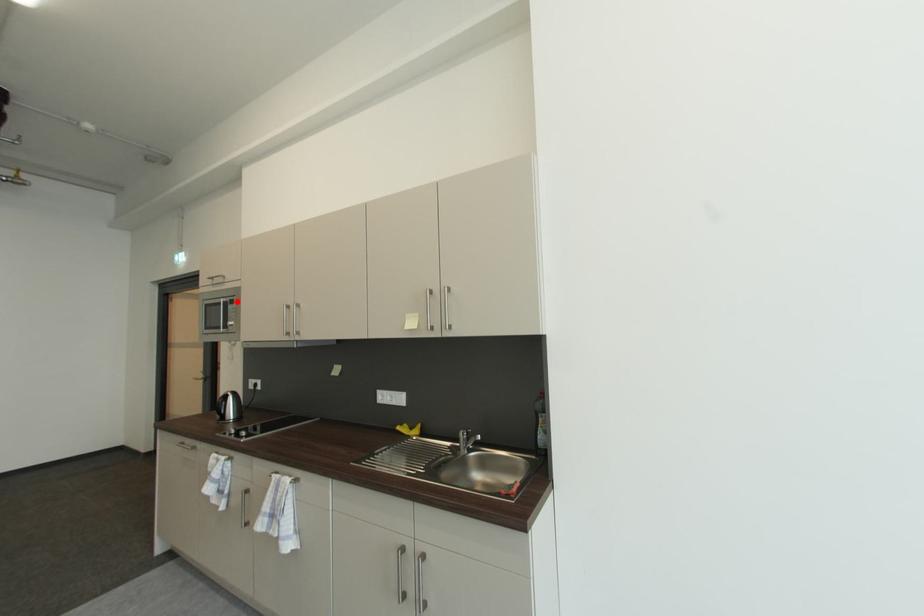
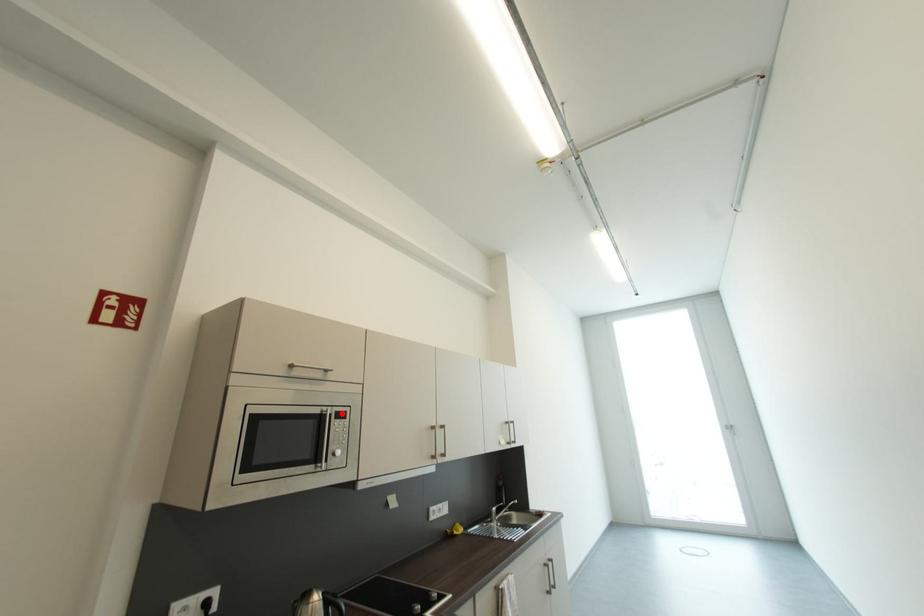
I am providing you with two images of the same scene from different viewpoints. A red point is marked on the first image and another point is marked on the second image. Is the red point in image1 aligned with the point shown in image2?

Yes